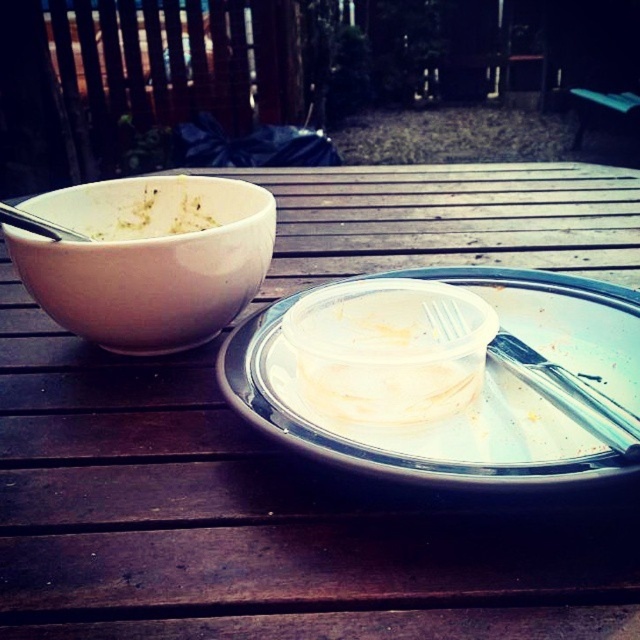
You are hosting a backyard barbecue and need to serve food. You have a clear plastic container at center and a metallic silver fork at center on the table. Which item can hold more food?

The clear plastic container at center has a larger size compared to the metallic silver fork at center, so it can hold more food.